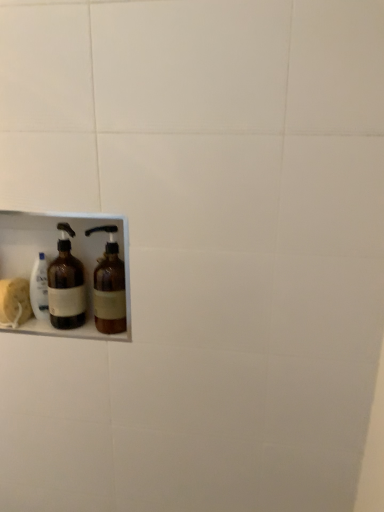
Question: Should I look upward or downward to see brown glass bottle at left, the first bottle from the left?

Choices:
 (A) down
 (B) up

Answer: (A)

Question: Does brown glass bottle at left, the 2th bottle positioned from the right, have a lesser height compared to brown glass bottle at lower left, which ranks as the first bottle in right-to-left order?

Choices:
 (A) no
 (B) yes

Answer: (A)

Question: Is the depth of brown glass bottle at left, the 2th bottle positioned from the right, greater than that of brown glass bottle at lower left, which ranks as the first bottle in right-to-left order?

Choices:
 (A) no
 (B) yes

Answer: (B)

Question: From the image's perspective, is brown glass bottle at left, the first bottle from the left, beneath brown glass bottle at lower left, which ranks as the first bottle in right-to-left order?

Choices:
 (A) no
 (B) yes

Answer: (A)

Question: Considering the relative positions of brown glass bottle at left, the 2th bottle positioned from the right, and brown glass bottle at lower left, which ranks as the first bottle in right-to-left order, in the image provided, is brown glass bottle at left, the 2th bottle positioned from the right, in front of brown glass bottle at lower left, which ranks as the first bottle in right-to-left order,?

Choices:
 (A) yes
 (B) no

Answer: (B)

Question: From a real-world perspective, does brown glass bottle at left, the 2th bottle positioned from the right, stand above brown glass bottle at lower left, which ranks as the first bottle in right-to-left order?

Choices:
 (A) no
 (B) yes

Answer: (A)

Question: Is brown glass bottle at left, the first bottle from the left, directly adjacent to brown glass bottle at lower left, the 2th bottle positioned from the left?

Choices:
 (A) no
 (B) yes

Answer: (B)

Question: Can you confirm if brown glass bottle at lower left, the 2th bottle positioned from the left, is wider than brown glass bottle at left, the first bottle from the left?

Choices:
 (A) yes
 (B) no

Answer: (A)

Question: Is brown glass bottle at lower left, the 2th bottle positioned from the left, positioned with its back to brown glass bottle at left, the first bottle from the left?

Choices:
 (A) yes
 (B) no

Answer: (B)

Question: Does brown glass bottle at lower left, the 2th bottle positioned from the left, have a smaller size compared to brown glass bottle at left, the 2th bottle positioned from the right?

Choices:
 (A) yes
 (B) no

Answer: (B)

Question: Is brown glass bottle at lower left, the 2th bottle positioned from the left, to the right of brown glass bottle at left, the 2th bottle positioned from the right, from the viewer's perspective?

Choices:
 (A) yes
 (B) no

Answer: (A)

Question: From a real-world perspective, does brown glass bottle at lower left, the 2th bottle positioned from the left, stand above brown glass bottle at left, the first bottle from the left?

Choices:
 (A) no
 (B) yes

Answer: (B)

Question: Is brown glass bottle at lower left, the 2th bottle positioned from the left, beside brown glass bottle at left, the 2th bottle positioned from the right?

Choices:
 (A) yes
 (B) no

Answer: (A)

Question: Considering the relative positions of brown glass bottle at lower left, which ranks as the first bottle in right-to-left order, and brown glass bottle at left, the 2th bottle positioned from the right, in the image provided, is brown glass bottle at lower left, which ranks as the first bottle in right-to-left order, to the left or to the right of brown glass bottle at left, the 2th bottle positioned from the right,?

Choices:
 (A) right
 (B) left

Answer: (A)